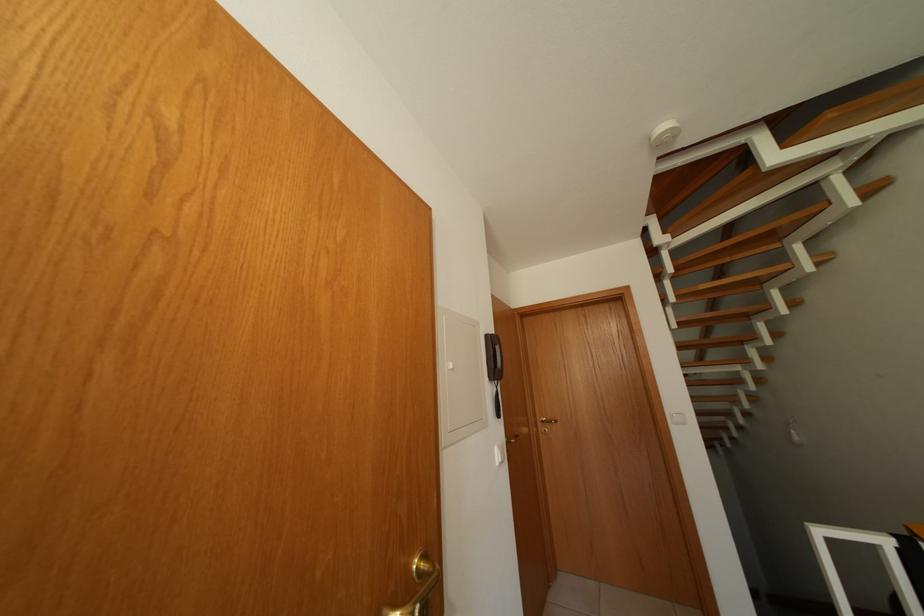
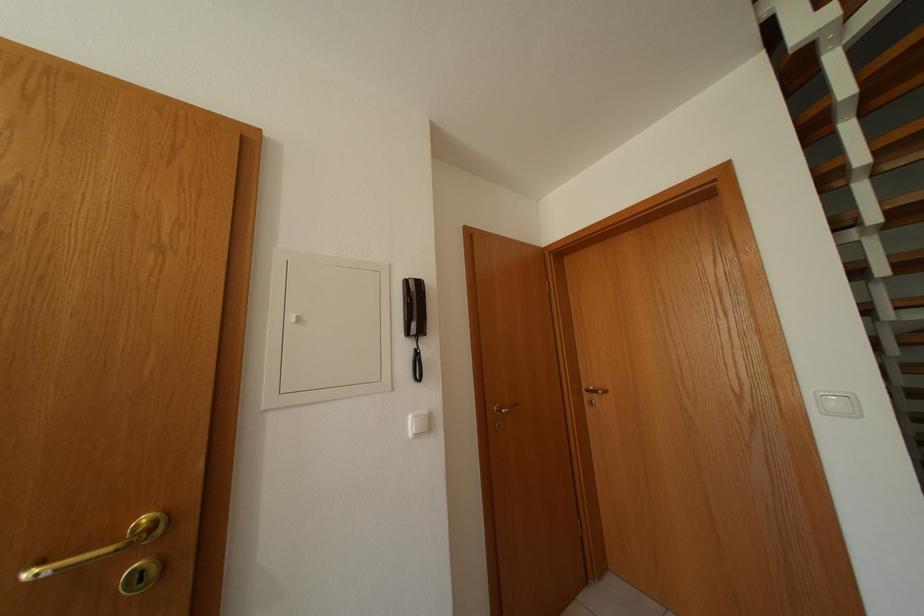
Question: The first image is from the beginning of the video and the second image is from the end. How did the camera likely rotate when shooting the video?

Choices:
 (A) Left
 (B) Right
 (C) Up
 (D) Down

Answer: (A)